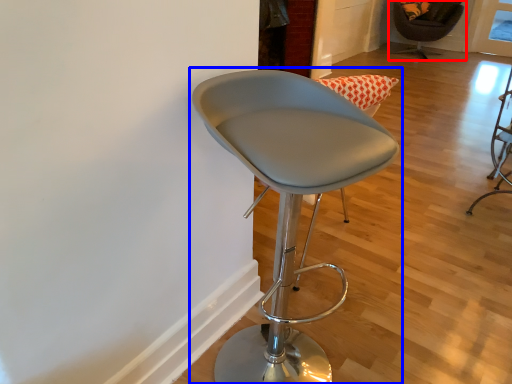
Question: Among these objects, which one is nearest to the camera, chair (highlighted by a red box) or chair (highlighted by a blue box)?

Choices:
 (A) chair
 (B) chair

Answer: (B)